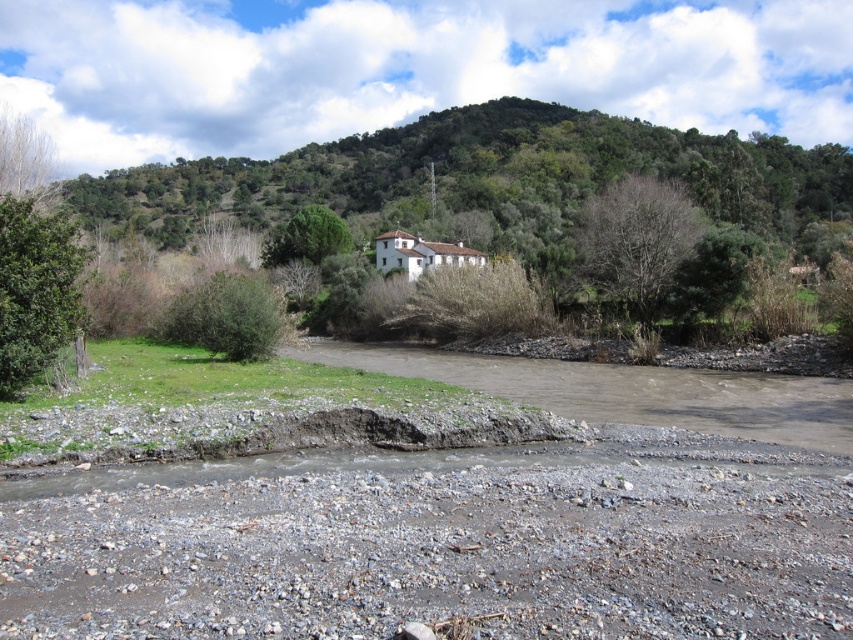
Question: Estimate the real-world distances between objects in this image. Which object is farther from the green leafy tree at upper left?

Choices:
 (A) green leafy bush at lower left
 (B) green leafy tree at left
 (C) green leafy tree at upper center
 (D) bare branches at upper right

Answer: (C)

Question: Does green leafy tree at left appear over green leafy bush at lower left?

Choices:
 (A) yes
 (B) no

Answer: (A)

Question: Is the position of bare branches at upper right more distant than that of green leafy bush at lower left?

Choices:
 (A) no
 (B) yes

Answer: (B)

Question: Among these objects, which one is farthest from the camera?

Choices:
 (A) green leafy bush at lower left
 (B) green leafy tree at upper center
 (C) green leafy tree at upper left

Answer: (B)

Question: Estimate the real-world distances between objects in this image. Which object is closer to the bare branches at upper right?

Choices:
 (A) green leafy tree at upper left
 (B) green leafy tree at upper center

Answer: (A)

Question: Considering the relative positions of green leafy bush at lower left and green leafy tree at upper center in the image provided, where is green leafy bush at lower left located with respect to green leafy tree at upper center?

Choices:
 (A) below
 (B) above

Answer: (A)